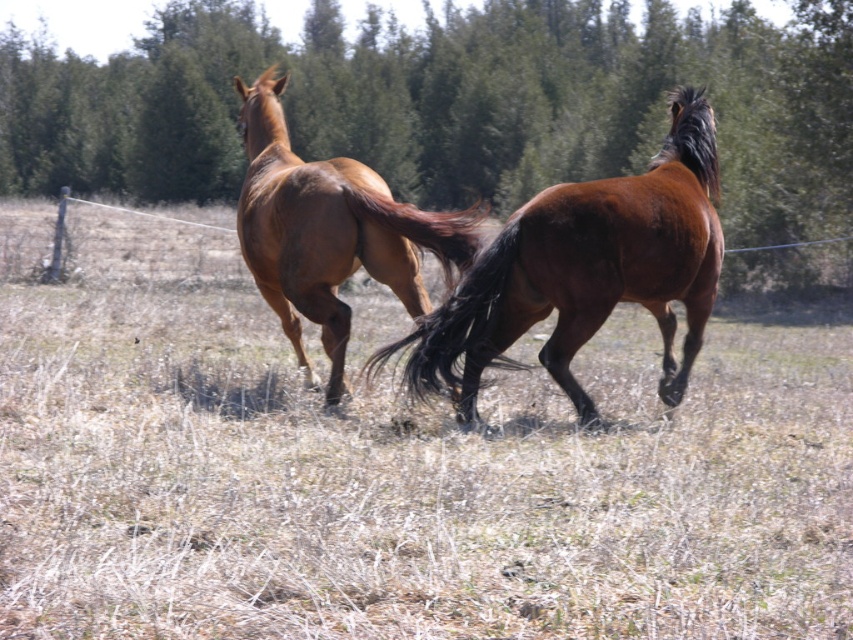
Question: Which of the following is the closest to the observer?

Choices:
 (A) black silky tail at center
 (B) brown dry grass at center
 (C) shiny brown horse at center

Answer: (B)

Question: Is green leafy tree at upper center behind shiny brown horse at center?

Choices:
 (A) no
 (B) yes

Answer: (B)

Question: Which point appears farthest from the camera in this image?

Choices:
 (A) (392, 346)
 (B) (422, 228)
 (C) (86, 177)

Answer: (C)

Question: Can you confirm if brown glossy horse at center is positioned below shiny brown horse at center?

Choices:
 (A) yes
 (B) no

Answer: (A)

Question: Is brown dry grass at center smaller than brown silky tail at center?

Choices:
 (A) no
 (B) yes

Answer: (A)

Question: Estimate the real-world distances between objects in this image. Which object is closer to the green leafy tree at upper center?

Choices:
 (A) brown dry grass at center
 (B) shiny brown horse at center

Answer: (B)